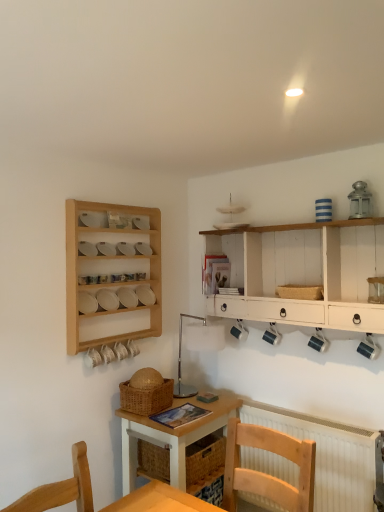
Question: Considering their positions, is wooden chair at lower center located in front of or behind wooden shelf at left?

Choices:
 (A) front
 (B) behind

Answer: (A)

Question: Based on their sizes in the image, would you say wooden chair at lower center is bigger or smaller than wooden shelf at left?

Choices:
 (A) big
 (B) small

Answer: (A)

Question: Based on their relative distances, which object is nearer to the woven brown basket at center, placed as the 2th basket when sorted from right to left?

Choices:
 (A) wooden shelf at left
 (B) white wood shelf at upper right
 (C) wooden chair at lower center
 (D) light wood desk at center
 (E) white textured radiator at lower right

Answer: (D)

Question: Estimate the real-world distances between objects in this image. Which object is farther from the wooden chair at lower center?

Choices:
 (A) wooden shelf at left
 (B) white wood shelf at upper right
 (C) light wood desk at center
 (D) white textured radiator at lower right
 (E) woven brown basket at center, acting as the first basket starting from the bottom

Answer: (A)